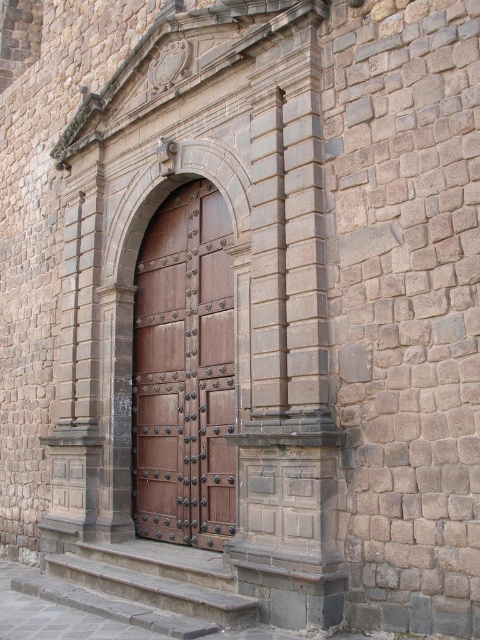
You are a painter who needs to move a ladder from the gray stone steps at lower center to the brown polished wood door at center. Considering their widths, will the ladder fit through the space between them?

The brown polished wood door at center has a lesser width compared to gray stone steps at lower center, so the ladder can fit through the space between them as the door is narrower than the steps.

You are a tour guide explaining the architecture of the building. You want to highlight the size comparison between the brown polished wood door at center and the gray stone steps at lower center. How would you phrase this in your tour?

The brown polished wood door at center is larger in size than the gray stone steps at lower center, so I would mention that the grand wooden door at the center towers over the smaller stone steps below it, emphasizing its prominence in the architectural design.

You are standing in front of the historic stone building and notice two points marked on the image. The first point is at coordinates point [149,404] and the second is at point [117,582]. Which point is closer to your eyes?

Point [149,404] is further to the camera than point [117,582], so the point closer to your eyes is point [117,582].